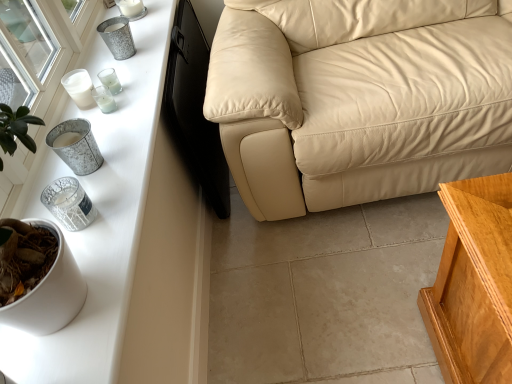
The height and width of the screenshot is (384, 512). Find the location of `free location to the right of metallic textured candle holder at upper left, which ranks as the 1th candle holder in top-to-bottom order`. free location to the right of metallic textured candle holder at upper left, which ranks as the 1th candle holder in top-to-bottom order is located at coordinates (154, 52).